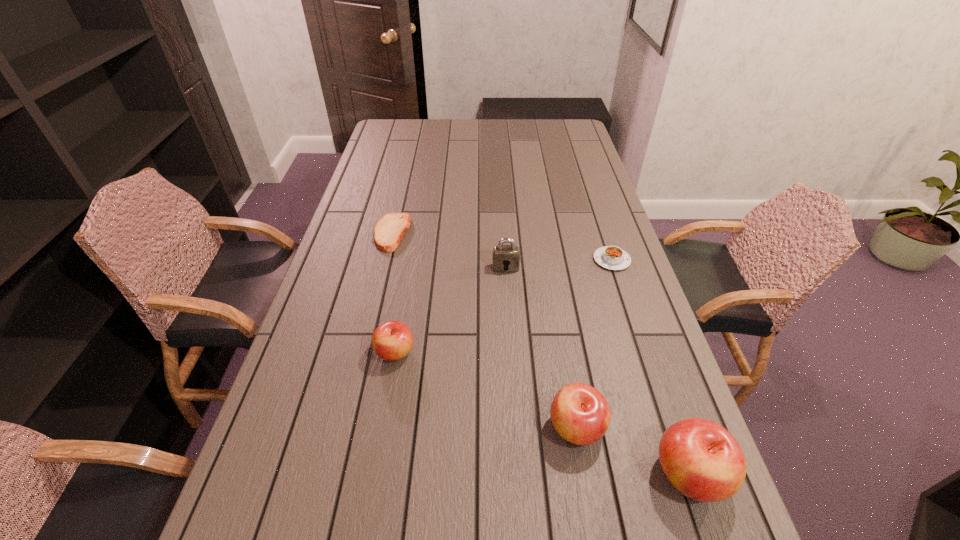
The width and height of the screenshot is (960, 540). Find the location of `free location that satisfies the following two spatial constraints: 1. on the back side of the fifth tallest object; 2. on the left side of the third shortest object`. free location that satisfies the following two spatial constraints: 1. on the back side of the fifth tallest object; 2. on the left side of the third shortest object is located at coordinates (411, 260).

In order to click on free space that satisfies the following two spatial constraints: 1. on the front side of the pita bread; 2. on the left side of the tallest apple in this screenshot , I will do `click(334, 475)`.

This screenshot has width=960, height=540. What are the coordinates of `vacant point that satisfies the following two spatial constraints: 1. on the front side of the second apple from right to left; 2. on the right side of the leftmost apple` in the screenshot? It's located at (382, 428).

This screenshot has height=540, width=960. What are the coordinates of `free spot that satisfies the following two spatial constraints: 1. on the front side of the third shortest object; 2. on the right side of the pita bread` in the screenshot? It's located at (364, 353).

Locate an element on the screen. free point that satisfies the following two spatial constraints: 1. on the front side of the third shortest object; 2. on the left side of the shortest object is located at coordinates (364, 353).